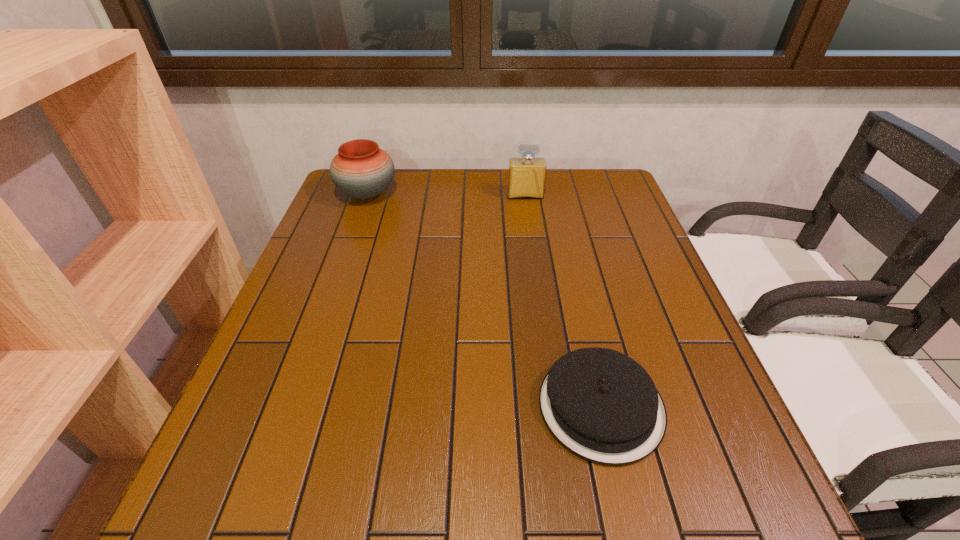
Identify the location of object located in the right edge section of the desktop. The width and height of the screenshot is (960, 540). (x=603, y=406).

At what (x,y) coordinates should I click in order to perform the action: click on object that is at the far left corner. Please return your answer as a coordinate pair (x, y). Image resolution: width=960 pixels, height=540 pixels. Looking at the image, I should click on [362, 170].

Where is `vacant space at the far edge`? The height and width of the screenshot is (540, 960). vacant space at the far edge is located at coordinates (493, 189).

Find the location of a particular element. free spot at the near edge of the desktop is located at coordinates (600, 508).

This screenshot has height=540, width=960. Identify the location of free region at the left edge of the desktop. (294, 343).

At what (x,y) coordinates should I click in order to perform the action: click on vacant space at the right edge of the desktop. Please return your answer as a coordinate pair (x, y). This screenshot has height=540, width=960. Looking at the image, I should click on (613, 231).

At what (x,y) coordinates should I click in order to perform the action: click on free location at the far right corner. Please return your answer as a coordinate pair (x, y). Looking at the image, I should click on (614, 184).

This screenshot has width=960, height=540. In order to click on free space between the shortest object and the perfume in this screenshot , I will do `click(564, 301)`.

Identify the location of free space between the pottery and the perfume. (446, 195).

Where is `vacant region between the perfume and the leftmost object`? vacant region between the perfume and the leftmost object is located at coordinates click(x=446, y=195).